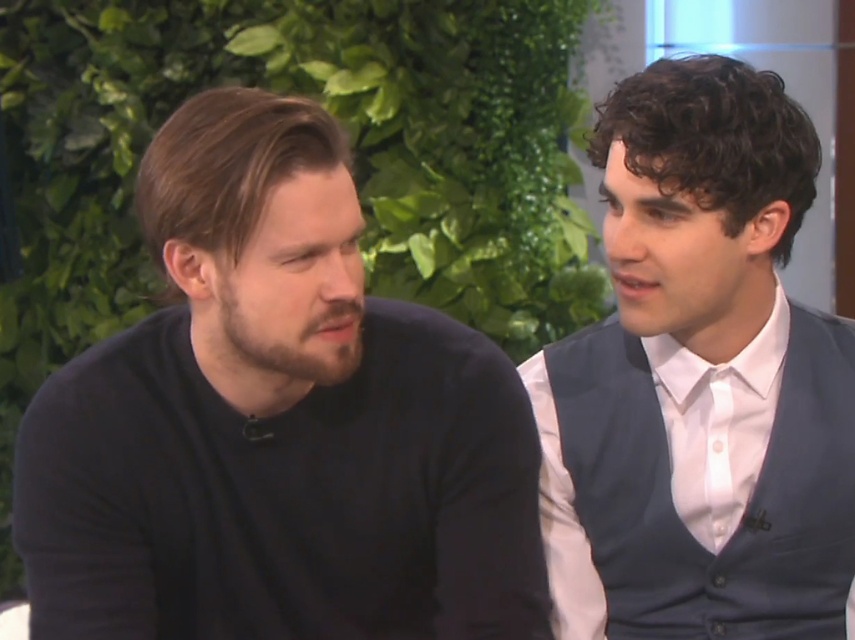
Question: Considering the relative positions of black matte sweater at left and white satin shirt at right in the image provided, where is black matte sweater at left located with respect to white satin shirt at right?

Choices:
 (A) right
 (B) left

Answer: (B)

Question: Does black matte sweater at left have a smaller size compared to white satin shirt at right?

Choices:
 (A) no
 (B) yes

Answer: (A)

Question: Among these objects, which one is nearest to the camera?

Choices:
 (A) black matte sweater at left
 (B) white satin shirt at right

Answer: (A)

Question: Does black matte sweater at left appear on the right side of white satin shirt at right?

Choices:
 (A) no
 (B) yes

Answer: (A)

Question: Which point is farther to the camera?

Choices:
 (A) white satin shirt at right
 (B) black matte sweater at left

Answer: (A)